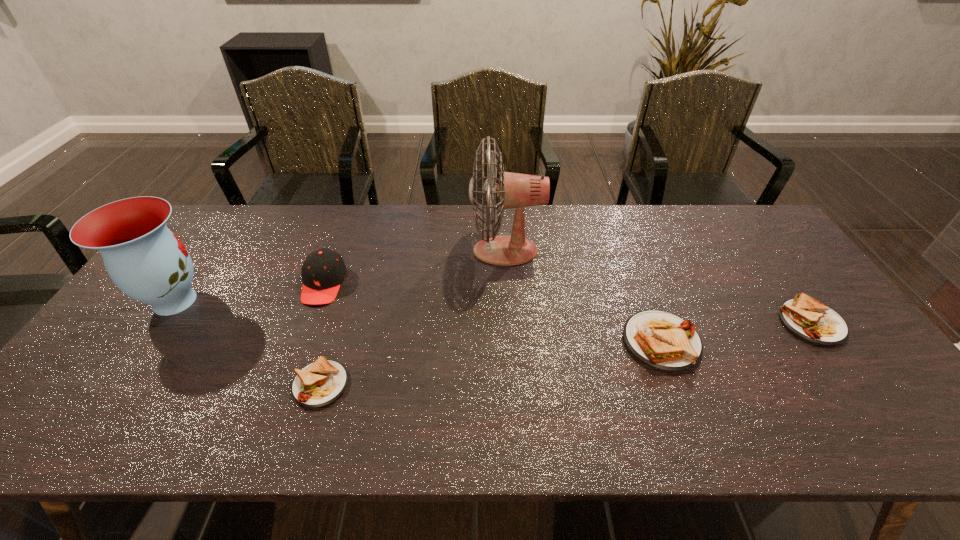
Where is `object at the left edge`? The width and height of the screenshot is (960, 540). object at the left edge is located at coordinates tap(146, 261).

You are a GUI agent. You are given a task and a screenshot of the screen. Output one action in this format:
    pyautogui.click(x=<x>, y=<y>)
    Task: Click on the object that is at the right edge
    The width and height of the screenshot is (960, 540).
    Given the screenshot: What is the action you would take?
    pyautogui.click(x=807, y=318)

Find the location of a particular element. free spot at the far edge of the desktop is located at coordinates (387, 206).

The width and height of the screenshot is (960, 540). Find the location of `free point at the near edge`. free point at the near edge is located at coordinates (643, 372).

In the image, there is a desktop. Where is `vacant region at the left edge`? The width and height of the screenshot is (960, 540). vacant region at the left edge is located at coordinates (111, 351).

Find the location of a particular element. The height and width of the screenshot is (540, 960). free spot at the right edge of the desktop is located at coordinates (752, 259).

Locate an element on the screen. The image size is (960, 540). vacant space at the far right corner of the desktop is located at coordinates (731, 222).

Where is `free point between the cap and the tallest sandwich`? This screenshot has height=540, width=960. free point between the cap and the tallest sandwich is located at coordinates coord(492,313).

Identify the location of free space that is in between the fan and the fifth tallest object. (659, 287).

Find the location of a particular element. free space between the third tallest object and the fourth object from left to right is located at coordinates (415, 267).